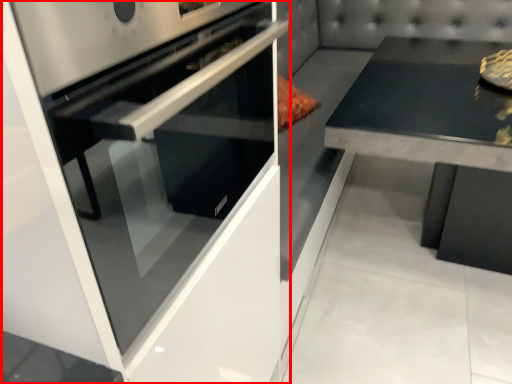
Question: From the image, what is the correct spatial relationship of home appliance (annotated by the red box) in relation to round table?

Choices:
 (A) right
 (B) left

Answer: (B)